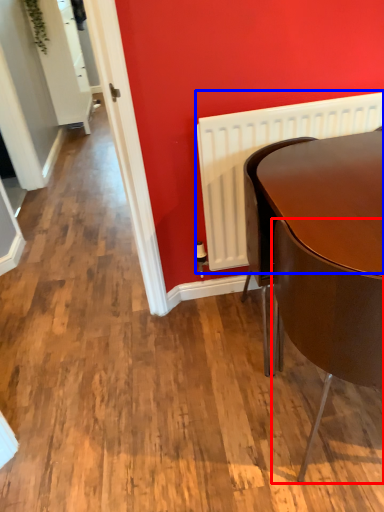
Question: Which of the following is the farthest to the observer, chair (highlighted by a red box) or radiator (highlighted by a blue box)?

Choices:
 (A) chair
 (B) radiator

Answer: (B)